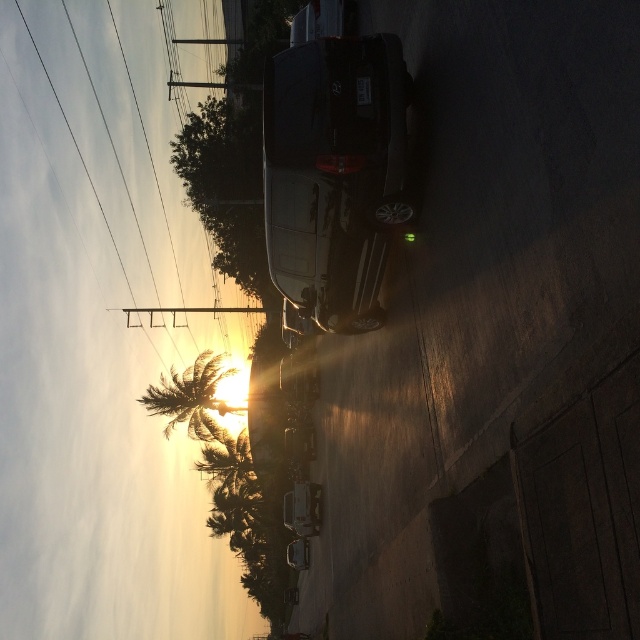
Is point (211, 436) in front of point (225, 465)?

That is False.

Does green leafy palm tree at lower left have a greater height compared to green leafy palm tree at lower center?

Yes.

This screenshot has height=640, width=640. I want to click on green leafy palm tree at lower left, so click(x=193, y=397).

Which is below, satin black suv at center or green leafy palm tree at lower left?

green leafy palm tree at lower left is below.

Does satin black suv at center have a larger size compared to green leafy palm tree at lower left?

Actually, satin black suv at center might be smaller than green leafy palm tree at lower left.

You are a GUI agent. You are given a task and a screenshot of the screen. Output one action in this format:
    pyautogui.click(x=<x>, y=<y>)
    Task: Click on the satin black suv at center
    The width and height of the screenshot is (640, 640).
    Given the screenshot: What is the action you would take?
    pyautogui.click(x=333, y=173)

Where is `satin black suv at center`? satin black suv at center is located at coordinates (333, 173).

Can you confirm if satin black suv at center is shorter than green leafy palm tree at lower center?

In fact, satin black suv at center may be taller than green leafy palm tree at lower center.

Does satin black suv at center have a smaller size compared to green leafy palm tree at lower center?

Actually, satin black suv at center might be larger than green leafy palm tree at lower center.

Measure the distance between point (304, 157) and camera.

Point (304, 157) is 33.38 feet away from camera.

The width and height of the screenshot is (640, 640). Find the location of `satin black suv at center`. satin black suv at center is located at coordinates (333, 173).